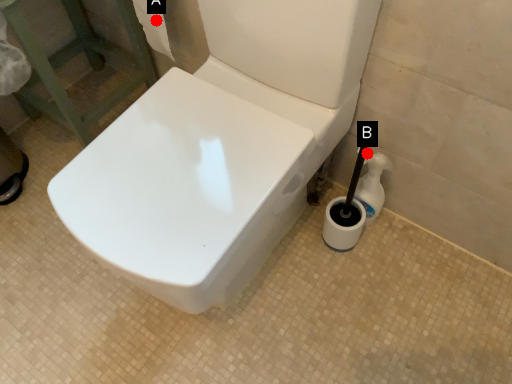
Question: Two points are circled on the image, labeled by A and B beside each circle. Among these points, which one is farthest from the camera?

Choices:
 (A) A is further
 (B) B is further

Answer: (A)